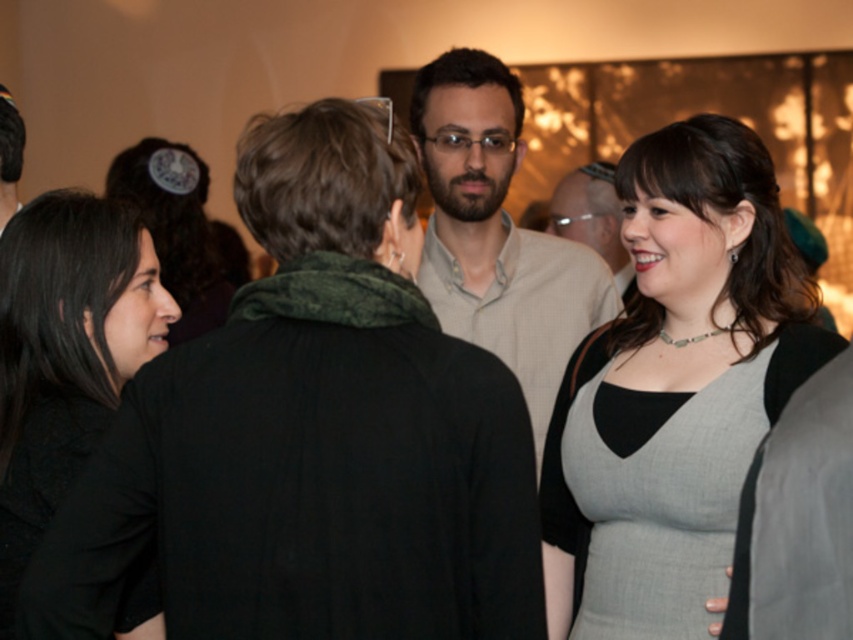
You are standing at the point labeled point (239, 500) and want to move to the point labeled point (715, 385). Can you walk directly towards it without any obstacles blocking your path?

Yes, you can walk directly towards point (715, 385) from point (239, 500) because point (239, 500) is in front of point (715, 385), meaning there are no obstructions between them.

In the scene described, there are two people wearing black clothing. The first is wearing a matte black dress at lower right, and the second is wearing a matte black shirt at center. From the perspective of someone standing at the entrance of the room, which of these two black garments is positioned closer to the right side of the room?

The matte black shirt at center is positioned closer to the right side of the room because the matte black dress at lower right is to the left of it.